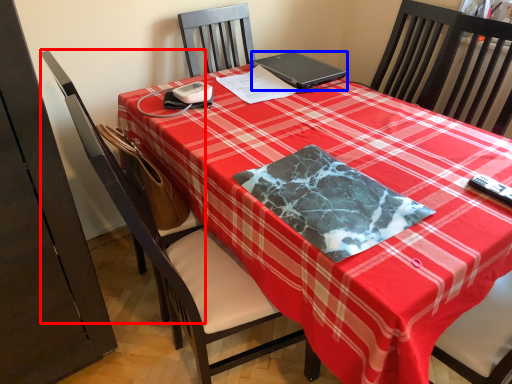
Question: Among these objects, which one is nearest to the camera, swivel chair (highlighted by a red box) or laptop (highlighted by a blue box)?

Choices:
 (A) swivel chair
 (B) laptop

Answer: (A)